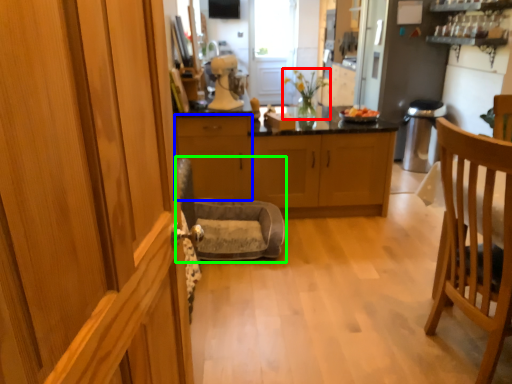
Question: Which object is positioned farthest from houseplant (highlighted by a red box)? Select from cabinetry (highlighted by a blue box) and rocking chair (highlighted by a green box).

Choices:
 (A) cabinetry
 (B) rocking chair

Answer: (B)